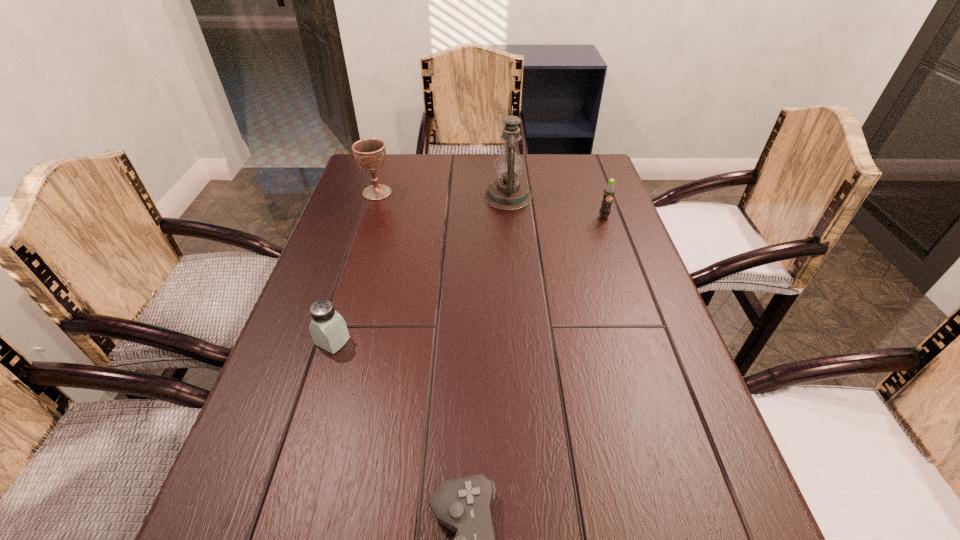
At what (x,y) coordinates should I click in order to perform the action: click on chalice at the far edge. Please return your answer as a coordinate pair (x, y). The height and width of the screenshot is (540, 960). Looking at the image, I should click on (370, 153).

The image size is (960, 540). Find the location of `chalice that is at the left edge`. chalice that is at the left edge is located at coordinates (370, 153).

At what (x,y) coordinates should I click in order to perform the action: click on saltshaker situated at the left edge. Please return your answer as a coordinate pair (x, y). Looking at the image, I should click on (328, 329).

Find the location of a particular element. The image size is (960, 540). object located at the right edge is located at coordinates (609, 191).

You are a GUI agent. You are given a task and a screenshot of the screen. Output one action in this format:
    pyautogui.click(x=<x>, y=<y>)
    Task: Click on the object at the far left corner
    The width and height of the screenshot is (960, 540).
    Given the screenshot: What is the action you would take?
    pyautogui.click(x=370, y=153)

Where is `free region at the far edge of the desktop`? free region at the far edge of the desktop is located at coordinates (533, 178).

Locate an element on the screen. The image size is (960, 540). blank space at the left edge is located at coordinates (316, 460).

The image size is (960, 540). In order to click on vacant region at the right edge of the desktop in this screenshot , I will do `click(655, 374)`.

In the image, there is a desktop. At what (x,y) coordinates should I click in order to perform the action: click on vacant space at the far left corner. Please return your answer as a coordinate pair (x, y). The height and width of the screenshot is (540, 960). Looking at the image, I should click on (394, 167).

Image resolution: width=960 pixels, height=540 pixels. Identify the location of free space at the far right corner of the desktop. (579, 178).